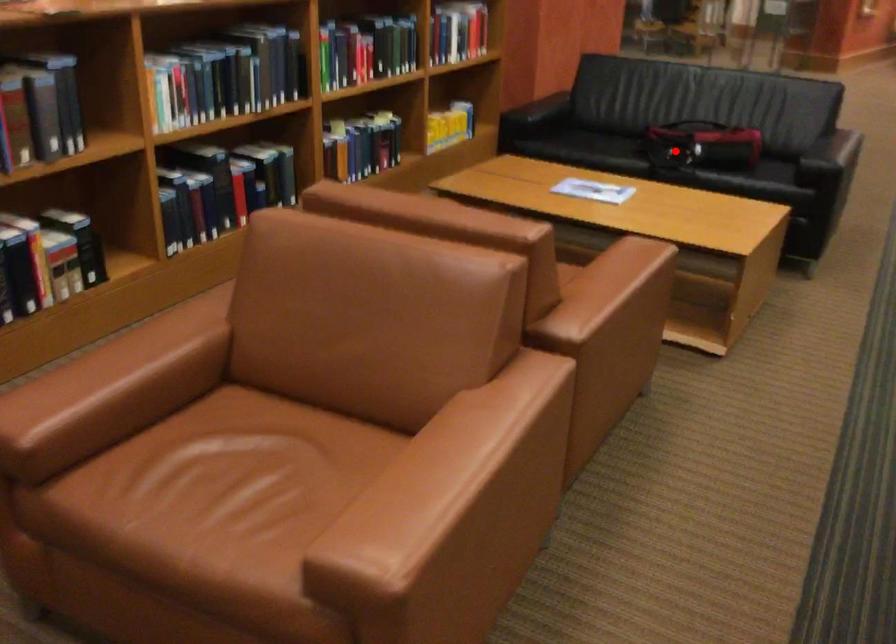
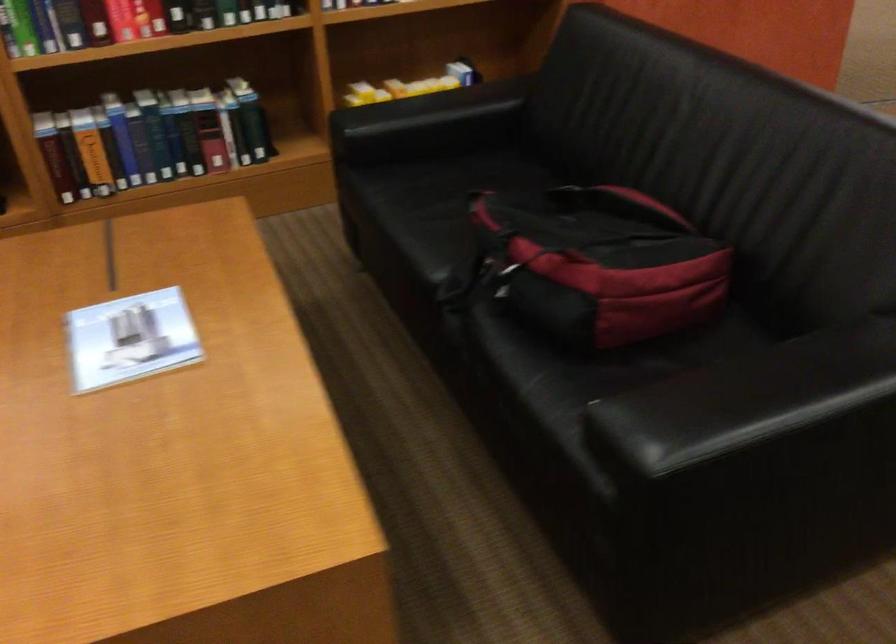
Locate, in the second image, the point that corresponds to the highlighted location in the first image.

(495, 269)